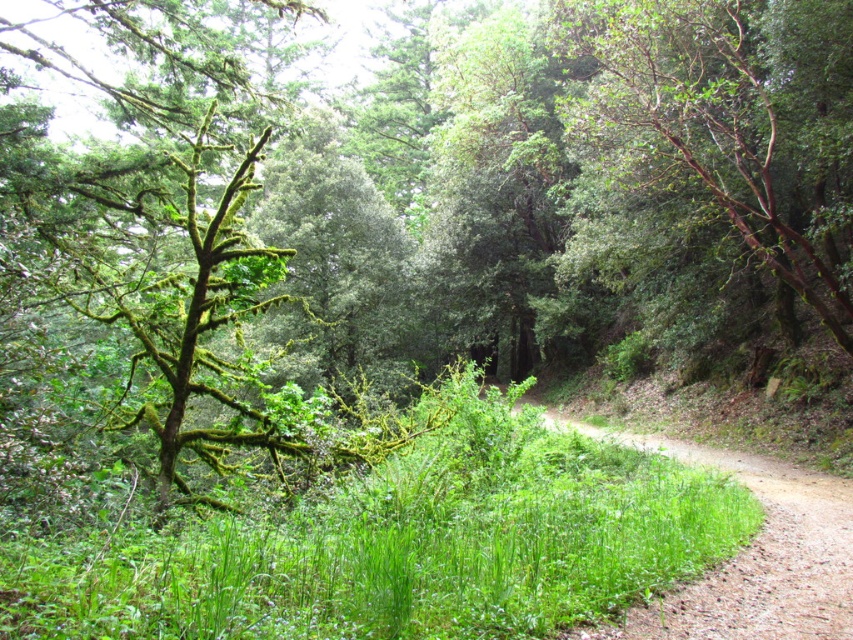
Consider the image. Is brown rough bark tree at upper right positioned at the back of dirt path at center?

That is True.

Does brown rough bark tree at upper right have a smaller size compared to dirt path at center?

Actually, brown rough bark tree at upper right might be larger than dirt path at center.

Where is `brown rough bark tree at upper right`? Image resolution: width=853 pixels, height=640 pixels. brown rough bark tree at upper right is located at coordinates (730, 122).

What do you see at coordinates (403, 541) in the screenshot? The width and height of the screenshot is (853, 640). I see `green leafy grass at center` at bounding box center [403, 541].

Does green leafy grass at center appear on the left side of brown rough bark tree at upper right?

Yes, green leafy grass at center is to the left of brown rough bark tree at upper right.

Between point (436, 429) and point (793, 92), which one is positioned behind?

Point (793, 92)

At what (x,y) coordinates should I click in order to perform the action: click on green leafy grass at center. Please return your answer as a coordinate pair (x, y). The width and height of the screenshot is (853, 640). Looking at the image, I should click on (403, 541).

Which is more to the left, green leafy grass at center or dirt path at center?

Positioned to the left is green leafy grass at center.

Is green leafy grass at center positioned at the back of dirt path at center?

That is False.

Which is in front, point (393, 481) or point (759, 618)?

Point (759, 618)

Where is `green leafy grass at center`? green leafy grass at center is located at coordinates (403, 541).